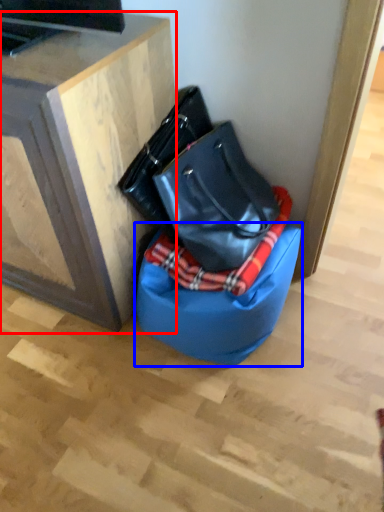
Question: Which of the following is the closest to the observer, furniture (highlighted by a red box) or bean bag chair (highlighted by a blue box)?

Choices:
 (A) furniture
 (B) bean bag chair

Answer: (A)